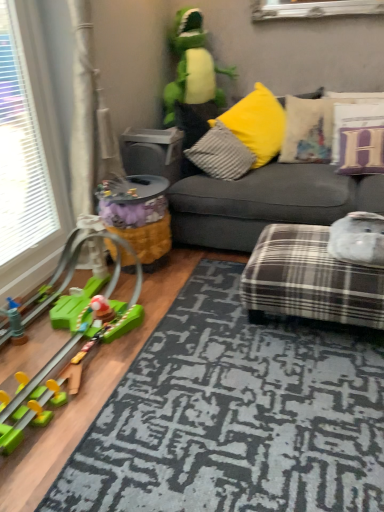
Question: Relative to gray fabric couch at center, the 2th studio couch in the bottom-to-top sequence, is plaid fabric ottoman at lower right, positioned as the 2th studio couch in top-to-bottom order, in front or behind?

Choices:
 (A) front
 (B) behind

Answer: (A)

Question: Based on their positions, is plaid fabric ottoman at lower right, the first studio couch positioned from the bottom, located to the left or right of gray fabric couch at center, the 1th studio couch in the top-to-bottom sequence?

Choices:
 (A) right
 (B) left

Answer: (A)

Question: Based on their relative distances, which object is farther from the green plastic toy at left, which is the 3th toy in top-to-bottom order?

Choices:
 (A) gray fabric couch at center, the 2th studio couch in the bottom-to-top sequence
 (B) white plastic window at left
 (C) green plush toy at upper center, which is the 3th toy from bottom to top
 (D) gray textured pillow at center, which is the 1th pillow from left to right
 (E) purple fabric pillow at upper right, marked as the first pillow in a right-to-left arrangement

Answer: (C)

Question: Considering the real-world distances, which object is closest to the yellow fabric toy at center, which is counted as the 2th toy, starting from the top?

Choices:
 (A) green plush toy at upper center, which is the 3th toy from bottom to top
 (B) gray fabric couch at center, the 1th studio couch in the top-to-bottom sequence
 (C) purple fabric pillow at upper right, marked as the first pillow in a right-to-left arrangement
 (D) gray textured pillow at center, the 3th pillow from the right
 (E) plaid fabric ottoman at lower right, positioned as the 2th studio couch in top-to-bottom order

Answer: (B)